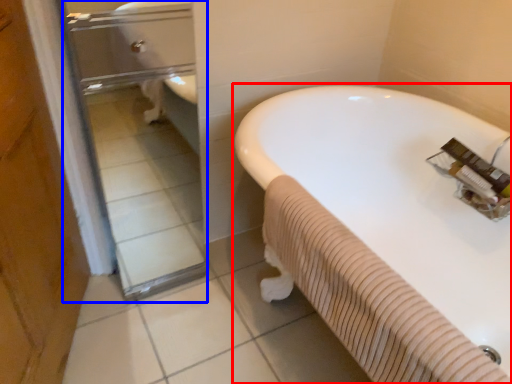
Question: Which of the following is the closest to the observer, bathtub (highlighted by a red box) or glass door (highlighted by a blue box)?

Choices:
 (A) bathtub
 (B) glass door

Answer: (A)